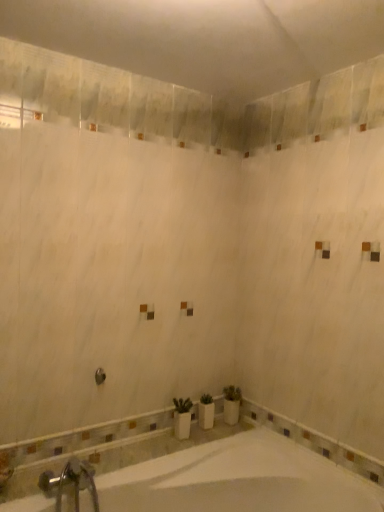
Question: From a real-world perspective, is brushed metal showerhead at center physically located above or below white glossy bathtub at lower center?

Choices:
 (A) below
 (B) above

Answer: (B)

Question: Would you say brushed metal showerhead at center is to the left or to the right of white glossy bathtub at lower center in the picture?

Choices:
 (A) right
 (B) left

Answer: (B)

Question: Which of these objects is positioned farthest from the white glossy bathtub at lower center?

Choices:
 (A) brushed metal showerhead at center
 (B) silver metallic faucet at lower left

Answer: (A)

Question: Which of these objects is positioned closest to the brushed metal showerhead at center?

Choices:
 (A) silver metallic faucet at lower left
 (B) white glossy bathtub at lower center

Answer: (A)